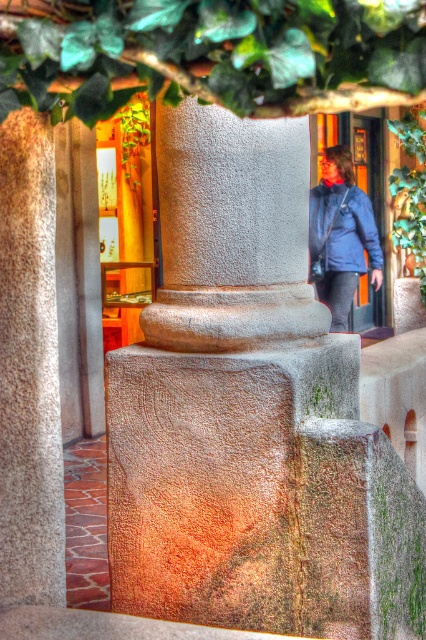
Question: Does green leafy tree at upper center appear on the left side of blue matte jacket at upper right?

Choices:
 (A) no
 (B) yes

Answer: (B)

Question: Is green leafy tree at upper center positioned before blue matte jacket at upper right?

Choices:
 (A) no
 (B) yes

Answer: (B)

Question: Which point is farther to the camera?

Choices:
 (A) (400, 29)
 (B) (354, 211)

Answer: (B)

Question: Is green leafy tree at upper center bigger than blue matte jacket at upper right?

Choices:
 (A) yes
 (B) no

Answer: (B)